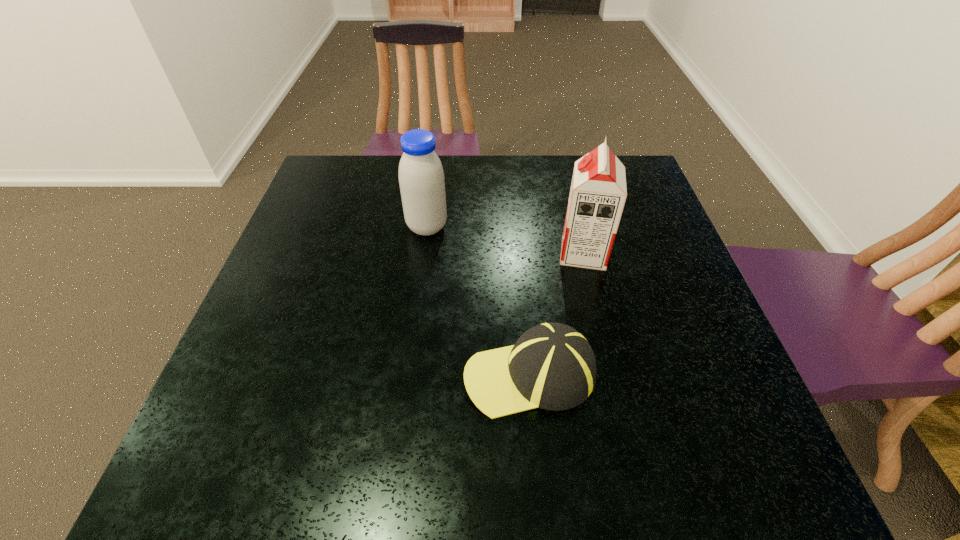
Find the location of a particular element. The image size is (960, 540). the right soya milk is located at coordinates (598, 192).

Locate an element on the screen. The width and height of the screenshot is (960, 540). the left soya milk is located at coordinates (421, 177).

What are the coordinates of `the nearest object` in the screenshot? It's located at (552, 366).

This screenshot has height=540, width=960. In order to click on baseball cap in this screenshot , I will do `click(552, 366)`.

Find the location of `free point located on the back of the right soya milk`. free point located on the back of the right soya milk is located at coordinates (563, 165).

Identify the location of vacant space located on the left of the left soya milk. This screenshot has width=960, height=540. (301, 227).

This screenshot has height=540, width=960. Identify the location of vacant space located with the brim of the baseball cap facing forward. (406, 374).

Where is `vacant space located with the brim of the baseball cap facing forward`? The height and width of the screenshot is (540, 960). vacant space located with the brim of the baseball cap facing forward is located at coordinates (275, 374).

Identify the location of vacant space located with the brim of the baseball cap facing forward. (411, 374).

This screenshot has height=540, width=960. Identify the location of free space at the far edge. (377, 168).